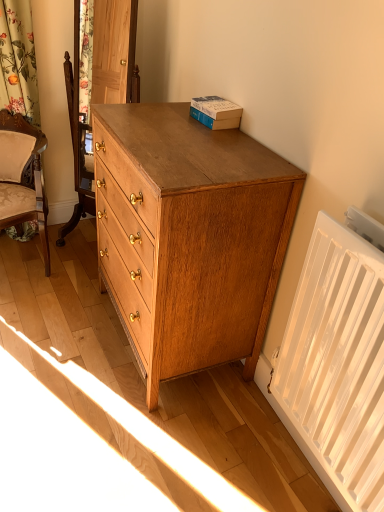
Identify the location of blank area beneath white plastic radiator at lower right (from a real-world perspective). (300, 462).